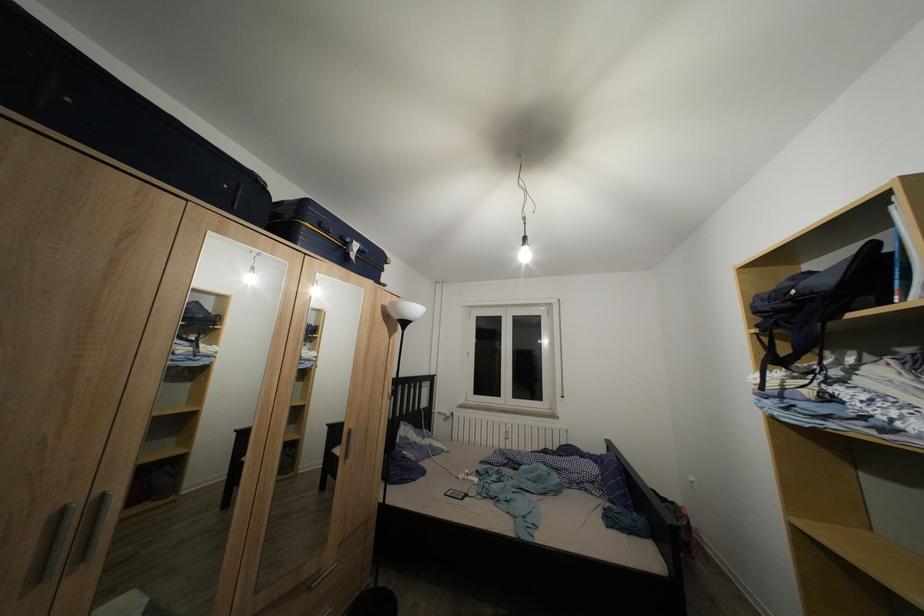
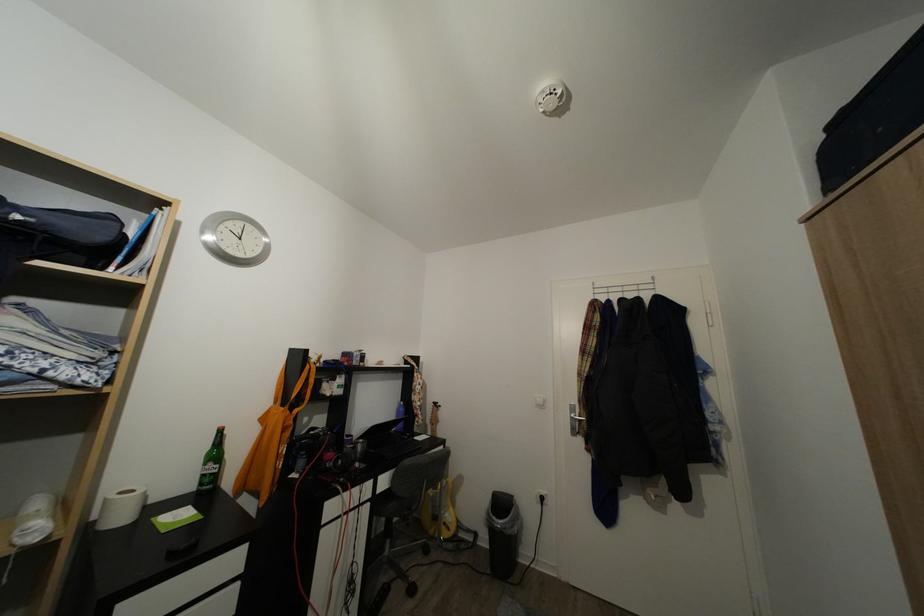
Where in the second image is the point corresponding to (801,298) from the first image?

(25, 223)